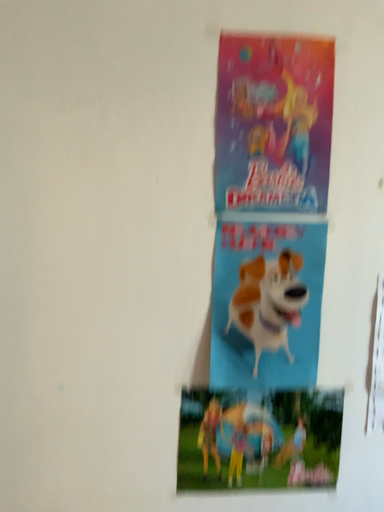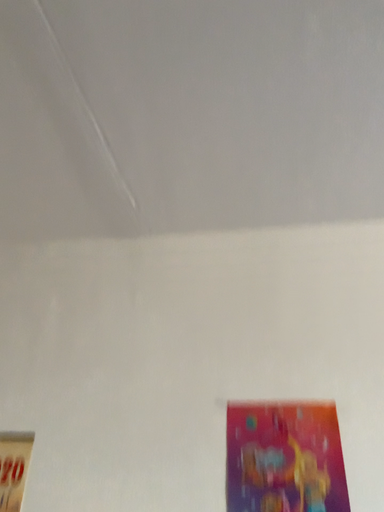
Question: Which way did the camera rotate in the video?

Choices:
 (A) rotated left
 (B) rotated right

Answer: (A)